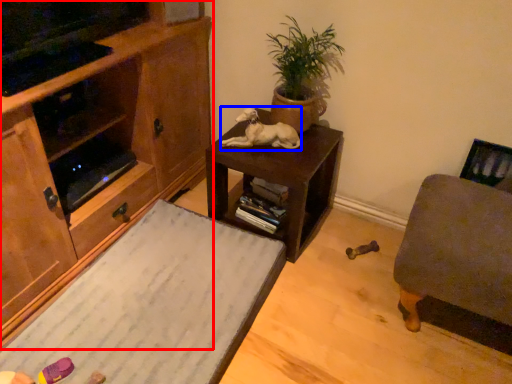
Question: Which object appears closest to the camera in this image, cabinetry (highlighted by a red box) or animal (highlighted by a blue box)?

Choices:
 (A) cabinetry
 (B) animal

Answer: (A)